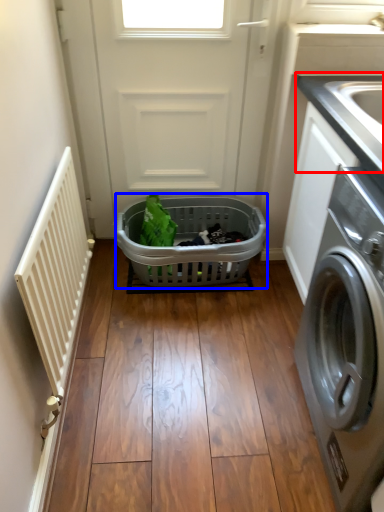
Question: Among these objects, which one is nearest to the camera, counter top (highlighted by a red box) or basket (highlighted by a blue box)?

Choices:
 (A) counter top
 (B) basket

Answer: (A)